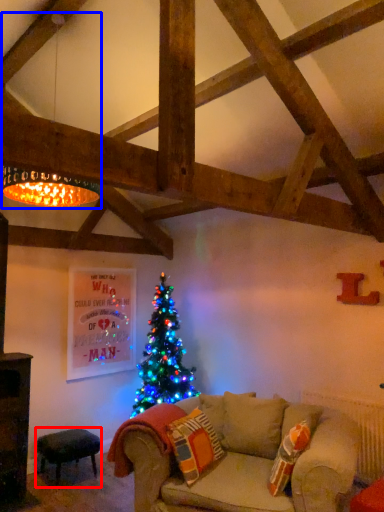
Question: Which of the following is the closest to the observer, stool (highlighted by a red box) or lamp (highlighted by a blue box)?

Choices:
 (A) stool
 (B) lamp

Answer: (B)